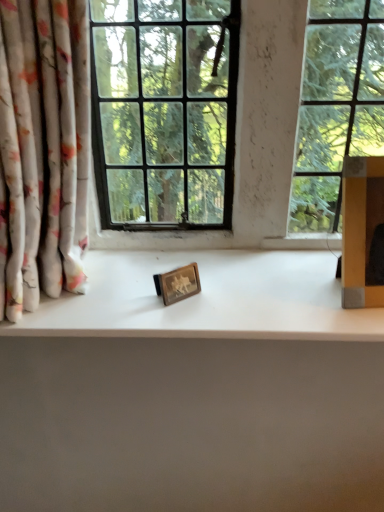
Question: Does white matte counter top at center have a lesser height compared to floral fabric curtain at left?

Choices:
 (A) no
 (B) yes

Answer: (B)

Question: From the image's perspective, is white matte counter top at center on top of floral fabric curtain at left?

Choices:
 (A) no
 (B) yes

Answer: (A)

Question: Is white matte counter top at center further to the viewer compared to floral fabric curtain at left?

Choices:
 (A) yes
 (B) no

Answer: (A)

Question: Can you confirm if white matte counter top at center is positioned to the left of floral fabric curtain at left?

Choices:
 (A) yes
 (B) no

Answer: (B)

Question: Is white matte counter top at center positioned in front of floral fabric curtain at left?

Choices:
 (A) yes
 (B) no

Answer: (B)

Question: From the image's perspective, is floral fabric curtain at left located above or below white matte counter top at center?

Choices:
 (A) below
 (B) above

Answer: (B)

Question: From a real-world perspective, is floral fabric curtain at left above or below white matte counter top at center?

Choices:
 (A) below
 (B) above

Answer: (B)

Question: Considering the positions of floral fabric curtain at left and white matte counter top at center in the image, is floral fabric curtain at left bigger or smaller than white matte counter top at center?

Choices:
 (A) small
 (B) big

Answer: (B)

Question: Considering the positions of floral fabric curtain at left and white matte counter top at center in the image, is floral fabric curtain at left taller or shorter than white matte counter top at center?

Choices:
 (A) short
 (B) tall

Answer: (B)

Question: Would you say white matte counter top at center is inside or outside wooden picture frame at center?

Choices:
 (A) outside
 (B) inside

Answer: (A)

Question: From a real-world perspective, is white matte counter top at center physically located above or below wooden picture frame at center?

Choices:
 (A) below
 (B) above

Answer: (A)

Question: Based on their sizes in the image, would you say white matte counter top at center is bigger or smaller than wooden picture frame at center?

Choices:
 (A) small
 (B) big

Answer: (B)

Question: Is white matte counter top at center wider or thinner than wooden picture frame at center?

Choices:
 (A) wide
 (B) thin

Answer: (A)

Question: Choose the correct answer: Is yellow cardboard box at right inside wooden picture frame at center or outside it?

Choices:
 (A) outside
 (B) inside

Answer: (A)

Question: Does point (379, 180) appear closer or farther from the camera than point (163, 283)?

Choices:
 (A) closer
 (B) farther

Answer: (A)